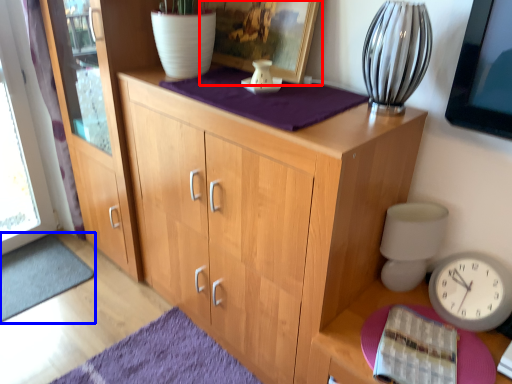
Question: Among these objects, which one is nearest to the camera, picture frame (highlighted by a red box) or doormat (highlighted by a blue box)?

Choices:
 (A) picture frame
 (B) doormat

Answer: (A)